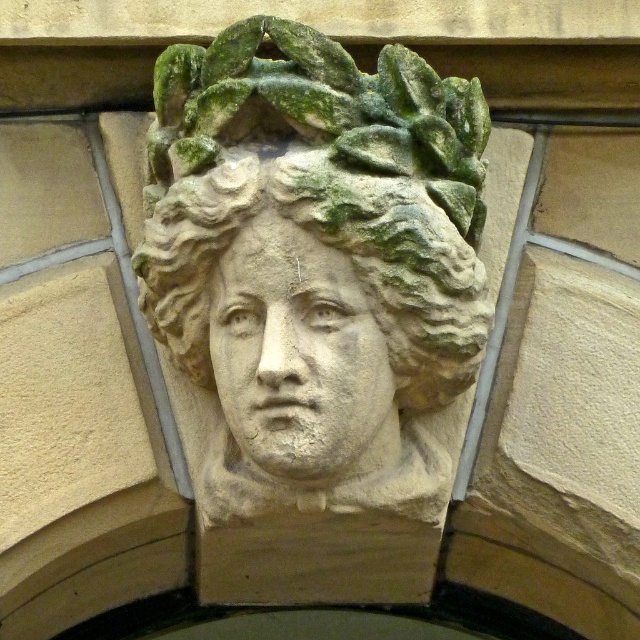
You are an architect examining the stone detail. You see a point at coordinates [316,262]. What does this point represent in the image?

The point at coordinates [316,262] corresponds to the stone sculpture at center.

Where is the stone sculpture at center located in the image?

The stone sculpture at center is located at coordinates point (316, 262).

Looking at this image, you are an architect examining the stone carving. You notice two points marked on the image at coordinates point [161,122] and point [291,404]. If you were to draw a straight line between them, would the line pass through the carved face?

The line between point [161,122] and point [291,404] would pass through the carved face because point [161,122] is behind point [291,404], meaning it is further away from the viewer. Therefore, the line would traverse from behind the face towards the viewer, intersecting the face along the way.